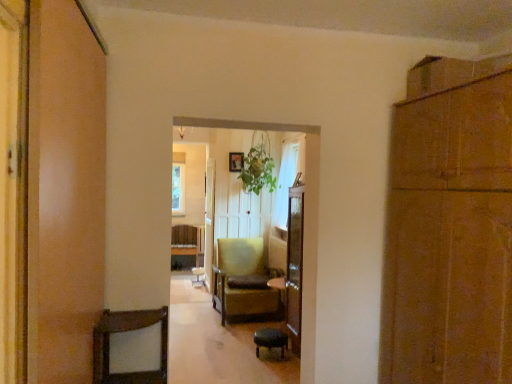
Question: Is brown leather bar stool at lower center further to camera compared to green leafy plant at center?

Choices:
 (A) no
 (B) yes

Answer: (A)

Question: From the image's perspective, would you say brown leather bar stool at lower center is shown under green leafy plant at center?

Choices:
 (A) yes
 (B) no

Answer: (A)

Question: Is brown leather bar stool at lower center turned away from green leafy plant at center?

Choices:
 (A) no
 (B) yes

Answer: (A)

Question: From a real-world perspective, is brown leather bar stool at lower center physically above green leafy plant at center?

Choices:
 (A) no
 (B) yes

Answer: (A)

Question: Does brown leather bar stool at lower center have a greater height compared to green leafy plant at center?

Choices:
 (A) no
 (B) yes

Answer: (A)

Question: Is brown leather bar stool at lower center touching green leafy plant at center?

Choices:
 (A) no
 (B) yes

Answer: (A)

Question: Is brown leather bar stool at lower center thinner than yellow fabric chair at center?

Choices:
 (A) no
 (B) yes

Answer: (B)

Question: Is brown leather bar stool at lower center far away from yellow fabric chair at center?

Choices:
 (A) yes
 (B) no

Answer: (B)

Question: Can you confirm if brown leather bar stool at lower center is bigger than yellow fabric chair at center?

Choices:
 (A) no
 (B) yes

Answer: (A)

Question: Is brown leather bar stool at lower center looking in the opposite direction of yellow fabric chair at center?

Choices:
 (A) no
 (B) yes

Answer: (A)

Question: Is brown leather bar stool at lower center placed right next to yellow fabric chair at center?

Choices:
 (A) no
 (B) yes

Answer: (A)

Question: Does brown leather bar stool at lower center come in front of yellow fabric chair at center?

Choices:
 (A) no
 (B) yes

Answer: (B)

Question: Is yellow fabric chair at center to the left of green leafy plant at center from the viewer's perspective?

Choices:
 (A) yes
 (B) no

Answer: (A)